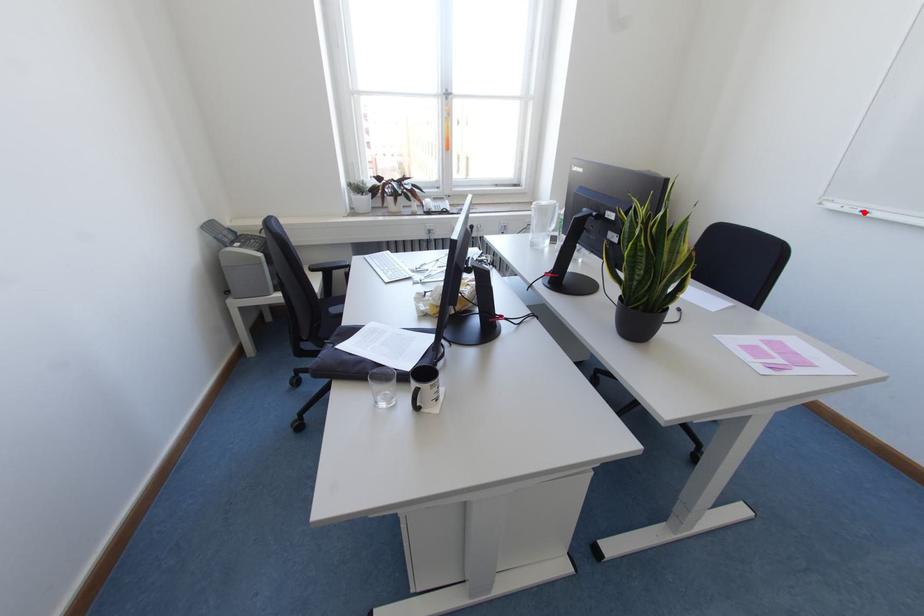
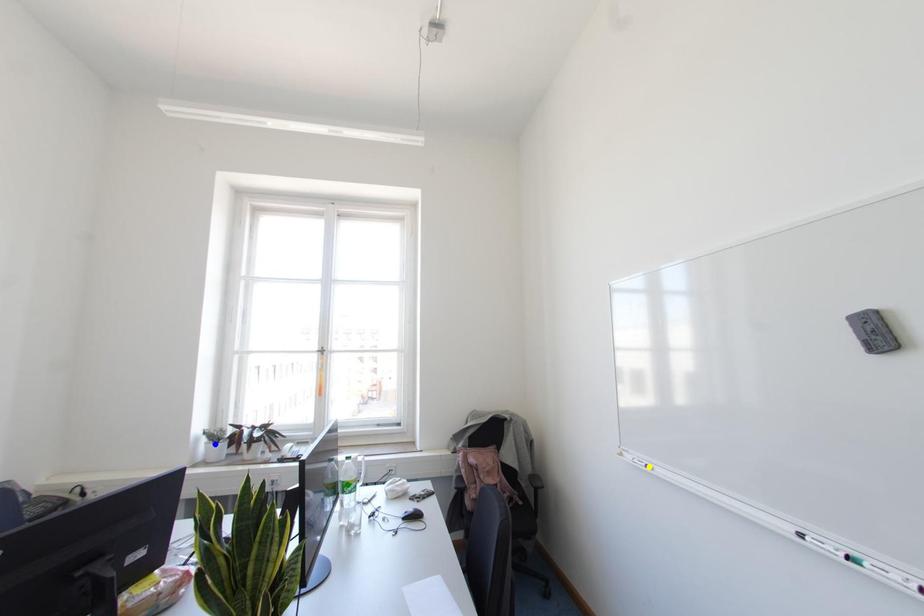
Question: I am providing you with two images of the same scene from different viewpoints. A red point is marked on the first image. You are given multiple points on the second image. Which point in image 2 represents the same 3d spot as the red point in image 1?

Choices:
 (A) yellow point
 (B) green point
 (C) blue point

Answer: (A)